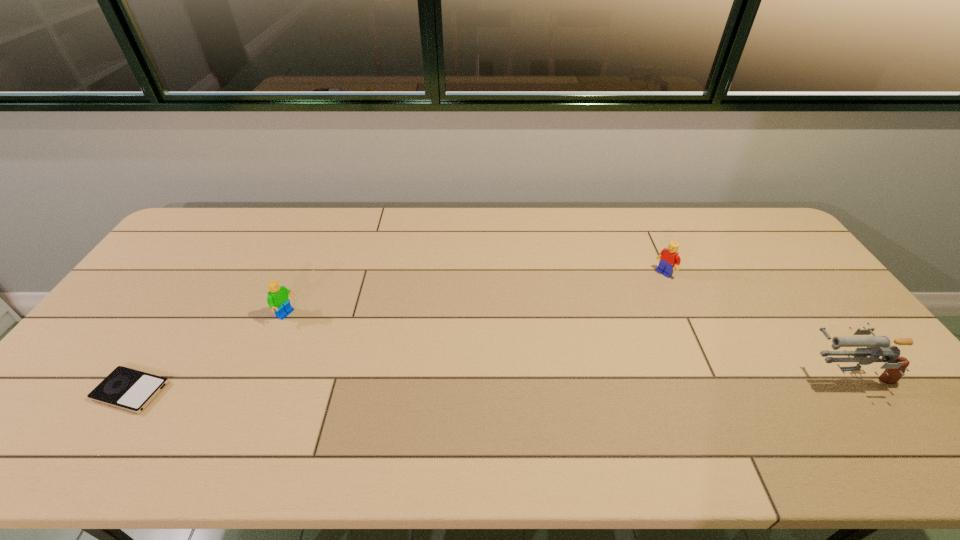
Find the location of a particular element. Image resolution: width=960 pixels, height=540 pixels. vacant point located between the tallest object and the iPod is located at coordinates (488, 382).

Locate an element on the screen. vacant area that lies between the nearer Lego and the iPod is located at coordinates (209, 353).

What are the coordinates of `vacant space that is in between the right Lego and the rightmost object` in the screenshot? It's located at (755, 323).

Locate an element on the screen. free point between the third nearest object and the rightmost object is located at coordinates (566, 345).

The height and width of the screenshot is (540, 960). I want to click on free space between the tallest object and the second farthest object, so click(x=566, y=345).

Locate an element on the screen. This screenshot has height=540, width=960. empty location between the right Lego and the leftmost object is located at coordinates (397, 332).

The height and width of the screenshot is (540, 960). Identify the location of empty space between the shortest object and the gun. (488, 382).

Find the location of a particular element. The image size is (960, 540). vacant area that lies between the leftmost object and the left Lego is located at coordinates (209, 353).

The width and height of the screenshot is (960, 540). In order to click on vacant space that's between the farthest object and the third nearest object in this screenshot , I will do `click(475, 294)`.

Locate which object ranks in proximity to the gun. Please provide its 2D coordinates. Your answer should be formatted as a tuple, i.e. [(x, y)], where the tuple contains the x and y coordinates of a point satisfying the conditions above.

[(669, 257)]